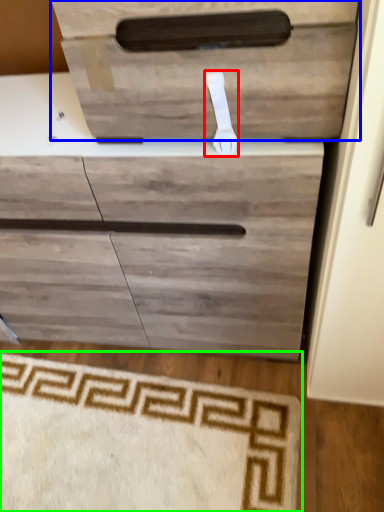
Question: Which object is positioned closest to door handle (highlighted by a red box)? Select from drawer (highlighted by a blue box) and doormat (highlighted by a green box).

Choices:
 (A) drawer
 (B) doormat

Answer: (A)